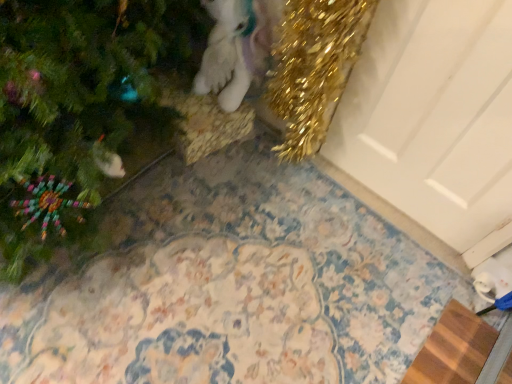
Question: From a real-world perspective, is white matte door at upper right located beneath white plush unicorn at upper center?

Choices:
 (A) yes
 (B) no

Answer: (B)

Question: Is white matte door at upper right not inside white plush unicorn at upper center?

Choices:
 (A) no
 (B) yes

Answer: (B)

Question: Can you confirm if white matte door at upper right is positioned to the left of white plush unicorn at upper center?

Choices:
 (A) no
 (B) yes

Answer: (A)

Question: Does white matte door at upper right come in front of white plush unicorn at upper center?

Choices:
 (A) no
 (B) yes

Answer: (B)

Question: Considering the relative positions of white matte door at upper right and white plush unicorn at upper center in the image provided, is white matte door at upper right to the right of white plush unicorn at upper center from the viewer's perspective?

Choices:
 (A) no
 (B) yes

Answer: (B)

Question: Can you confirm if white matte door at upper right is taller than white plush unicorn at upper center?

Choices:
 (A) yes
 (B) no

Answer: (A)

Question: From the image's perspective, would you say white plush unicorn at upper center is shown under brown woven mat at lower right?

Choices:
 (A) yes
 (B) no

Answer: (B)

Question: Is white plush unicorn at upper center to the right of brown woven mat at lower right from the viewer's perspective?

Choices:
 (A) yes
 (B) no

Answer: (B)

Question: Is white plush unicorn at upper center shorter than brown woven mat at lower right?

Choices:
 (A) yes
 (B) no

Answer: (B)

Question: Is white plush unicorn at upper center touching brown woven mat at lower right?

Choices:
 (A) no
 (B) yes

Answer: (A)

Question: Considering the relative sizes of white plush unicorn at upper center and brown woven mat at lower right in the image provided, is white plush unicorn at upper center bigger than brown woven mat at lower right?

Choices:
 (A) no
 (B) yes

Answer: (B)

Question: From the image's perspective, is white plush unicorn at upper center above brown woven mat at lower right?

Choices:
 (A) no
 (B) yes

Answer: (B)

Question: Considering the relative sizes of white plush unicorn at upper center and white matte door at upper right in the image provided, is white plush unicorn at upper center wider than white matte door at upper right?

Choices:
 (A) no
 (B) yes

Answer: (B)